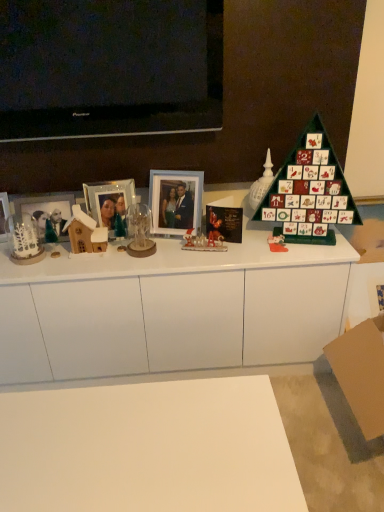
Identify the location of vacant space that is to the left of white glossy santa claus at center, marked as the fourth toy in a left-to-right arrangement. (168, 252).